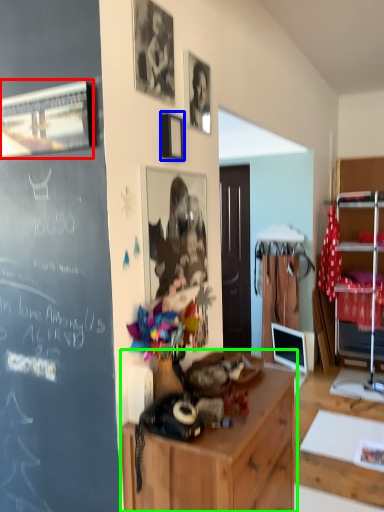
Question: Which object is the closest to the picture frame (highlighted by a red box)? Choose among these: picture frame (highlighted by a blue box) or cabinetry (highlighted by a green box).

Choices:
 (A) picture frame
 (B) cabinetry

Answer: (A)